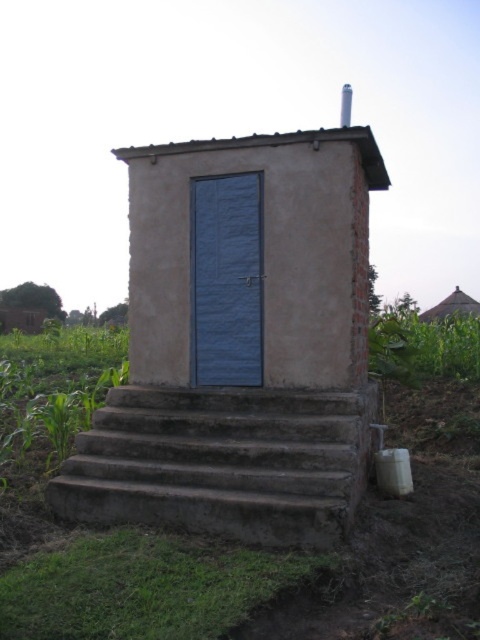
You are a delivery person trying to unload a heavy box from your cart. The box is too wide to fit through the entrance. You notice the concrete stairs at lower center and the brown thatched roof at upper right. Which of these two objects has a narrower width?

The concrete stairs at lower center is thinner than the brown thatched roof at upper right, so the concrete stairs at lower center has a narrower width.